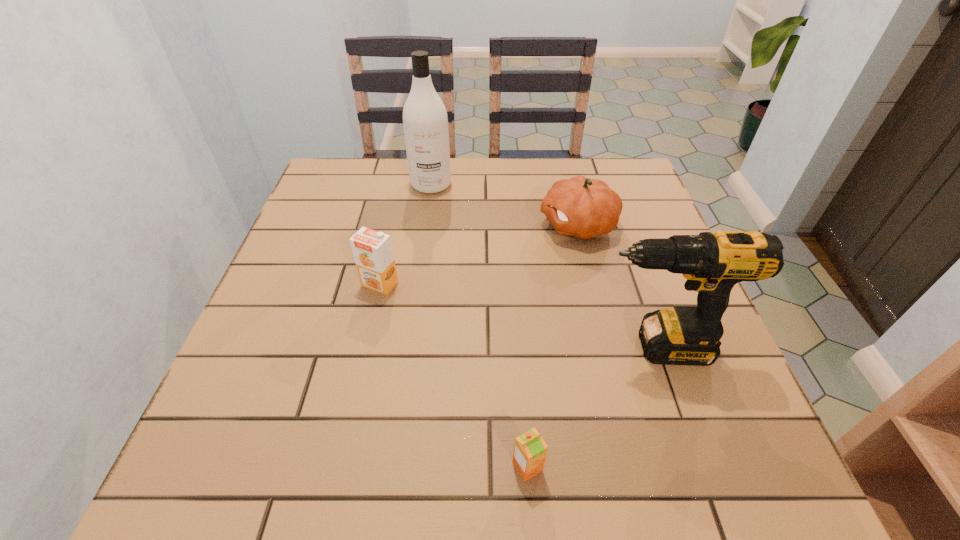
I want to click on the farthest object, so (x=425, y=121).

The height and width of the screenshot is (540, 960). Find the location of `the tallest object`. the tallest object is located at coordinates (425, 121).

Where is `drill`? drill is located at coordinates (712, 262).

Identify the location of the second nearest object. The height and width of the screenshot is (540, 960). (712, 262).

Find the location of a particular element. The image size is (960, 540). the second farthest object is located at coordinates (581, 207).

Identify the location of the left orange juice. The image size is (960, 540). (372, 250).

You are a GUI agent. You are given a task and a screenshot of the screen. Output one action in this format:
    pyautogui.click(x=<x>, y=<y>)
    Task: Click on the taller orange juice
    The width and height of the screenshot is (960, 540).
    Given the screenshot: What is the action you would take?
    pyautogui.click(x=372, y=250)

Where is `the nearest object`? This screenshot has height=540, width=960. the nearest object is located at coordinates (530, 450).

Identify the location of the shorter orange juice. (530, 450).

Where is `vacant space located 0.190m on the front-facing side of the tallest object`? Image resolution: width=960 pixels, height=540 pixels. vacant space located 0.190m on the front-facing side of the tallest object is located at coordinates (423, 241).